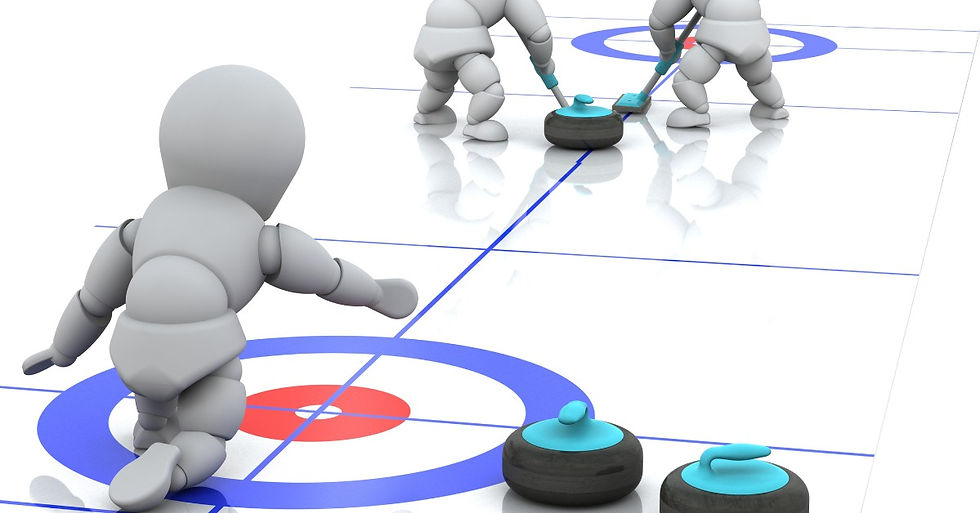
I want to click on floor, so click(x=635, y=304).